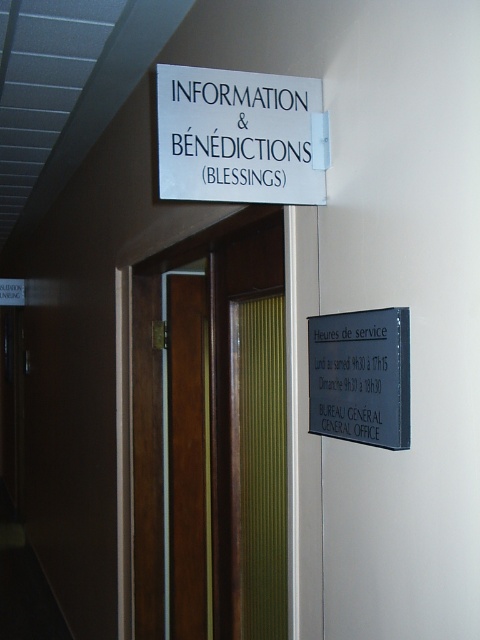
You are standing in the hallway and want to know which of the two points, point (223, 428) or point (405, 404), is closer to you. Based on the scene, can you determine this?

Point (405, 404) is closer to you because it is less further to the camera than point (223, 428).

You are standing in the hallway and want to determine which of the two points, point [180,74] or point [402,396], is closer to you. Based on the scene, which point is nearer?

Point [180,74] is further to the viewer than point [402,396], so the closer point to you is point [402,396].

You are a visitor at a French cultural center and need to locate the office hours. You see a white plastic sign at upper center and a metallic gray sign at right. Which sign contains the office hours information?

The metallic gray sign at right contains the office hours information because the white plastic sign at upper center is bigger and likely contains the main title, while the smaller metallic gray sign at right has the detailed office hours.